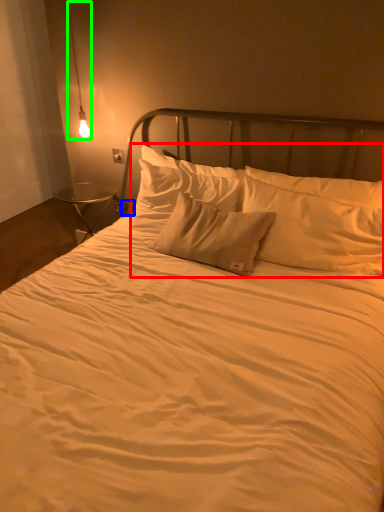
Question: Which object is positioned closest to pillow (highlighted by a red box)? Select from electric outlet (highlighted by a blue box) and lamp (highlighted by a green box).

Choices:
 (A) electric outlet
 (B) lamp

Answer: (A)